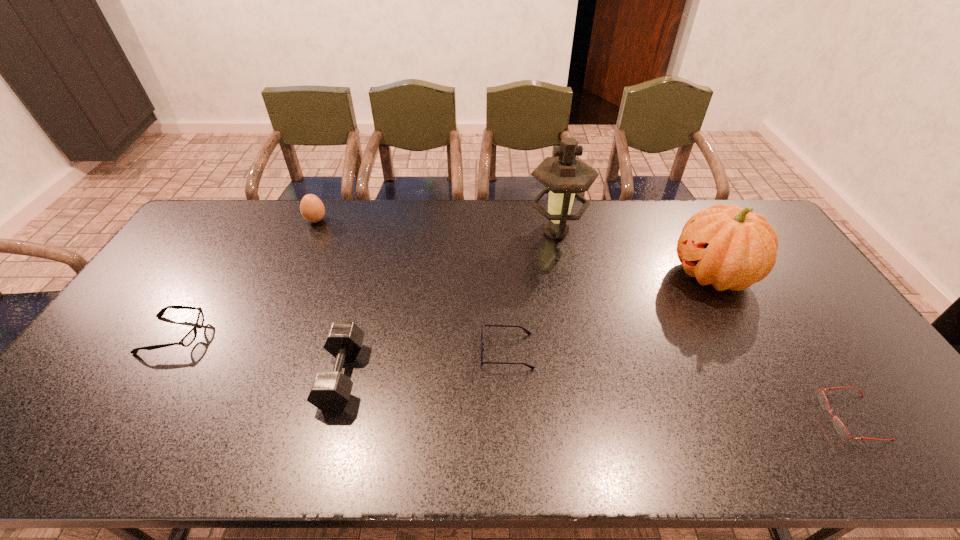
At what (x,y) coordinates should I click in order to perform the action: click on the third object from right to left. Please return your answer as a coordinate pair (x, y). Looking at the image, I should click on (566, 176).

Find the location of a particular element. Image resolution: width=960 pixels, height=540 pixels. oil lamp is located at coordinates (566, 176).

You are a GUI agent. You are given a task and a screenshot of the screen. Output one action in this format:
    pyautogui.click(x=<x>, y=<y>)
    Task: Click on the pumpkin
    This screenshot has width=960, height=540.
    Given the screenshot: What is the action you would take?
    pyautogui.click(x=731, y=248)

Where is `the fifth shortest object`? Image resolution: width=960 pixels, height=540 pixels. the fifth shortest object is located at coordinates (312, 209).

This screenshot has height=540, width=960. I want to click on the sixth object from right to left, so click(312, 209).

Find the location of a particular element. The width and height of the screenshot is (960, 540). dumbbell is located at coordinates (330, 391).

At what (x,y) coordinates should I click in order to perform the action: click on the fourth tallest object. Please return your answer as a coordinate pair (x, y). This screenshot has width=960, height=540. Looking at the image, I should click on [x=330, y=391].

Find the location of a particular element. The height and width of the screenshot is (540, 960). the fourth object from right to left is located at coordinates (529, 333).

Locate an element on the screen. The height and width of the screenshot is (540, 960). the leftmost spectacles is located at coordinates click(188, 339).

At what (x,y) coordinates should I click in order to perform the action: click on the nearest spectacles. Please return your answer as a coordinate pair (x, y). This screenshot has height=540, width=960. Looking at the image, I should click on (838, 425).